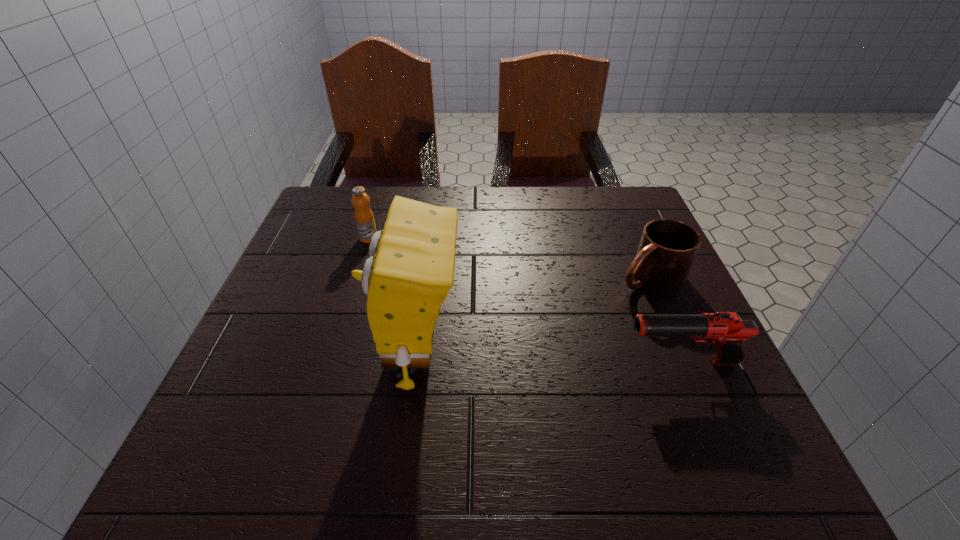
At what (x,y) coordinates should I click in order to perform the action: click on gun that is positioned at the right edge. Please return your answer as a coordinate pair (x, y). This screenshot has height=540, width=960. Looking at the image, I should click on (727, 331).

Locate an element on the screen. The image size is (960, 540). mug at the right edge is located at coordinates (667, 248).

Find the location of `object at the far left corner`. object at the far left corner is located at coordinates (364, 218).

In the image, there is a desktop. Identify the location of free space at the far edge. (540, 210).

Find the location of `free space at the near edge of the desktop`. free space at the near edge of the desktop is located at coordinates (371, 395).

In the image, there is a desktop. Where is `vacant space at the left edge`? The width and height of the screenshot is (960, 540). vacant space at the left edge is located at coordinates (359, 245).

This screenshot has width=960, height=540. Find the location of `free space at the far left corner of the desktop`. free space at the far left corner of the desktop is located at coordinates (343, 213).

Where is `vacant space at the near left corner of the desktop`? The width and height of the screenshot is (960, 540). vacant space at the near left corner of the desktop is located at coordinates (310, 385).

Identify the location of vacant space at the far right corner of the desktop. tap(602, 195).

At what (x,y) coordinates should I click in order to perform the action: click on free space at the near right corner of the desktop. Please return your answer as a coordinate pair (x, y). This screenshot has height=540, width=960. Looking at the image, I should click on (672, 412).